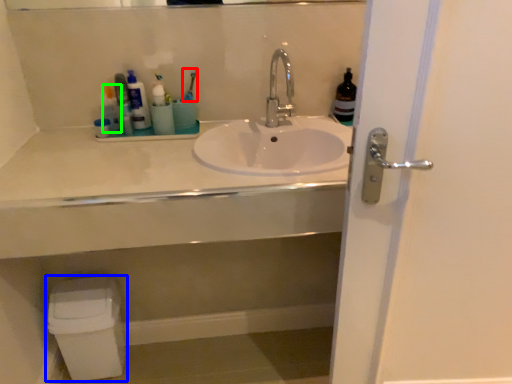
Question: Considering the real-world distances, which object is farthest from toothbrush (highlighted by a red box)? toilet bowl (highlighted by a blue box) or toiletry (highlighted by a green box)?

Choices:
 (A) toilet bowl
 (B) toiletry

Answer: (A)